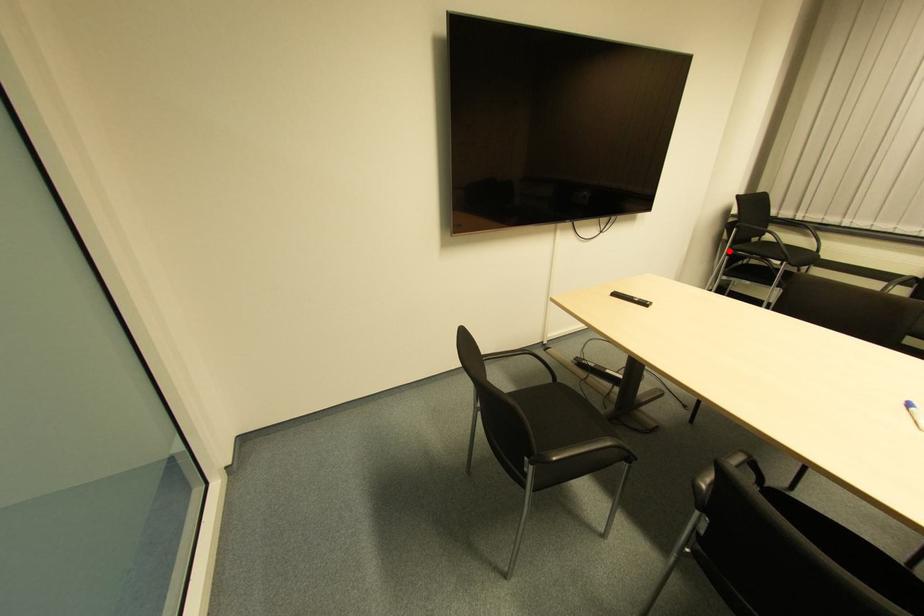
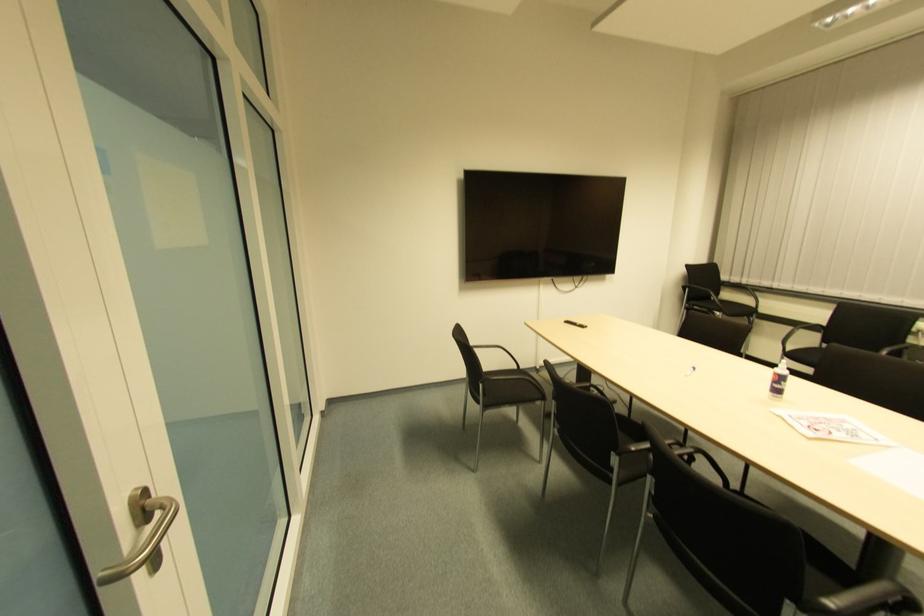
Find the pixel in the second image that matches the highlighted location in the first image.

(685, 306)